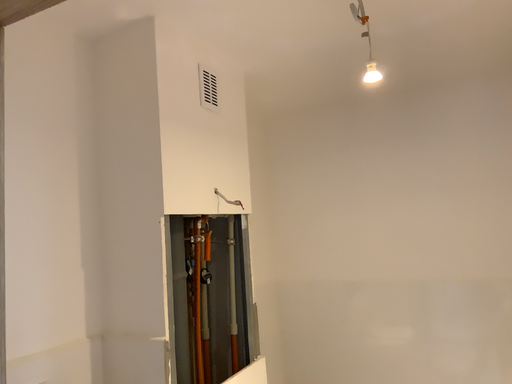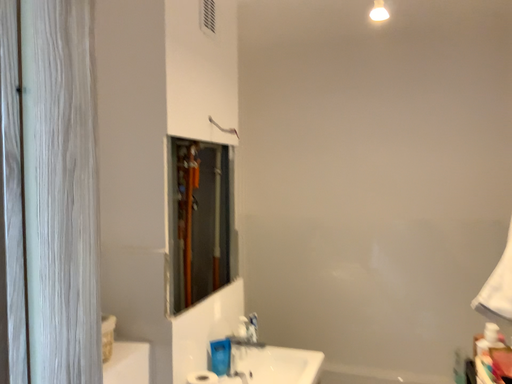
Question: How did the camera likely rotate when shooting the video?

Choices:
 (A) rotated downward
 (B) rotated upward

Answer: (A)